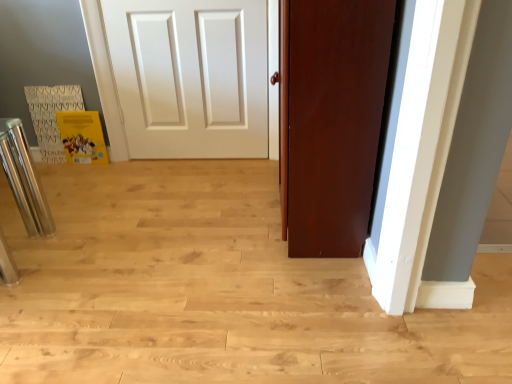
Question: Considering the positions of shiny metallic bar stool at left and matte brown door at center in the image, is shiny metallic bar stool at left taller or shorter than matte brown door at center?

Choices:
 (A) tall
 (B) short

Answer: (B)

Question: Based on their positions, is shiny metallic bar stool at left located to the left or right of matte brown door at center?

Choices:
 (A) left
 (B) right

Answer: (A)

Question: From the image's perspective, is shiny metallic bar stool at left above or below matte brown door at center?

Choices:
 (A) below
 (B) above

Answer: (A)

Question: From the image's perspective, is matte brown door at center above or below shiny metallic bar stool at left?

Choices:
 (A) above
 (B) below

Answer: (A)

Question: Considering the positions of matte brown door at center and shiny metallic bar stool at left in the image, is matte brown door at center bigger or smaller than shiny metallic bar stool at left?

Choices:
 (A) big
 (B) small

Answer: (A)

Question: Visually, is matte brown door at center positioned to the left or to the right of shiny metallic bar stool at left?

Choices:
 (A) left
 (B) right

Answer: (B)

Question: Considering the positions of point (295, 13) and point (28, 235), is point (295, 13) closer or farther from the camera than point (28, 235)?

Choices:
 (A) farther
 (B) closer

Answer: (B)